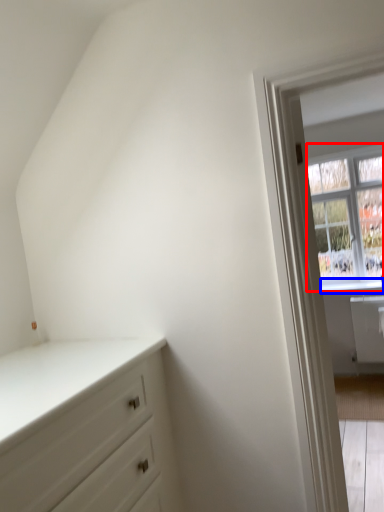
Question: Which point is closer to the camera, window (highlighted by a red box) or window sill (highlighted by a blue box)?

Choices:
 (A) window
 (B) window sill

Answer: (A)